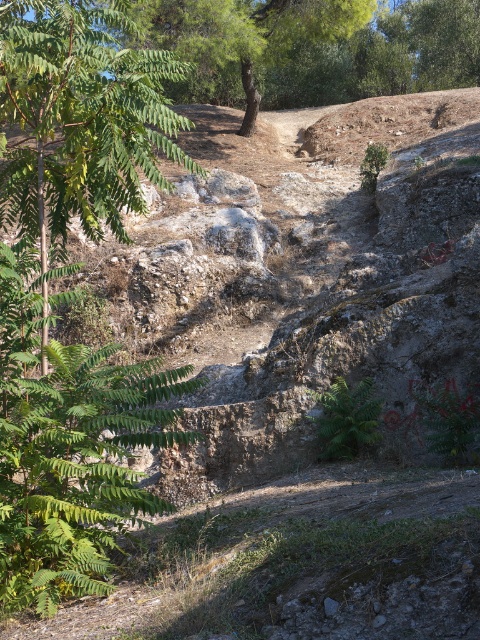
Question: Can you confirm if green leafy tree at upper center is thinner than green leafy fern at center?

Choices:
 (A) no
 (B) yes

Answer: (A)

Question: Which point is farther to the camera?

Choices:
 (A) green leafy fern at center
 (B) green leafy tree at upper center
 (C) green leafy fern at left

Answer: (A)

Question: Can you confirm if green leafy fern at left is positioned to the right of green leafy fern at center?

Choices:
 (A) yes
 (B) no

Answer: (B)

Question: Is green leafy tree at upper center closer to the viewer compared to green leafy fern at center?

Choices:
 (A) no
 (B) yes

Answer: (B)

Question: Which object is positioned farthest from the green leafy tree at upper center?

Choices:
 (A) green leafy fern at left
 (B) green leafy fern at center

Answer: (B)

Question: Which object is closer to the camera taking this photo?

Choices:
 (A) green leafy fern at center
 (B) green leafy tree at upper center
 (C) green leafy fern at left

Answer: (C)